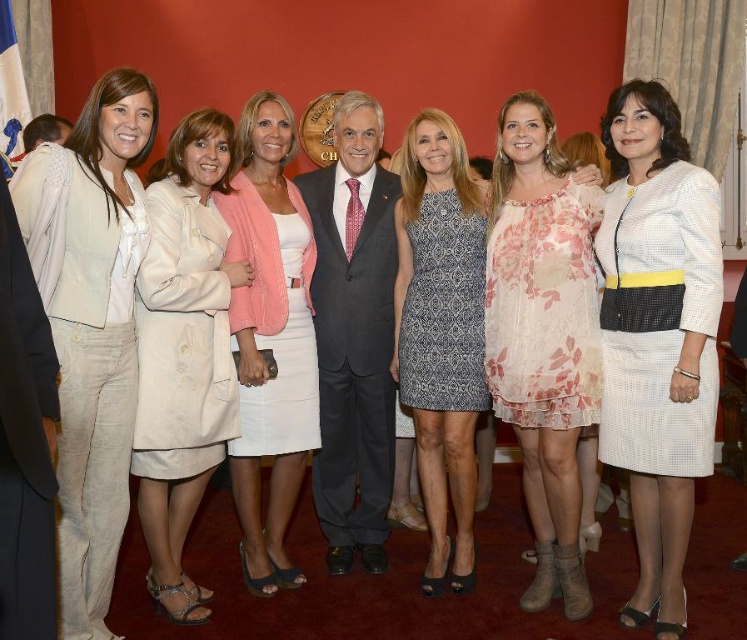
Question: Is floral lace dress at center in front of printed fabric dress at center?

Choices:
 (A) yes
 (B) no

Answer: (A)

Question: Is light beige linen pantsuit at left below light pink fabric skirt at center?

Choices:
 (A) no
 (B) yes

Answer: (B)

Question: Is white textured dress at center bigger than light beige fabric coat at center?

Choices:
 (A) no
 (B) yes

Answer: (B)

Question: Which point is closer to the camera?

Choices:
 (A) (570, 397)
 (B) (629, 353)
 (C) (477, 221)

Answer: (B)

Question: Which point is farther from the camera taking this photo?

Choices:
 (A) (523, 132)
 (B) (25, 196)
 (C) (441, 435)
 (D) (0, 32)

Answer: (D)

Question: Which of the following is the closest to the observer?

Choices:
 (A) dark gray suit at center
 (B) printed fabric dress at center

Answer: (B)